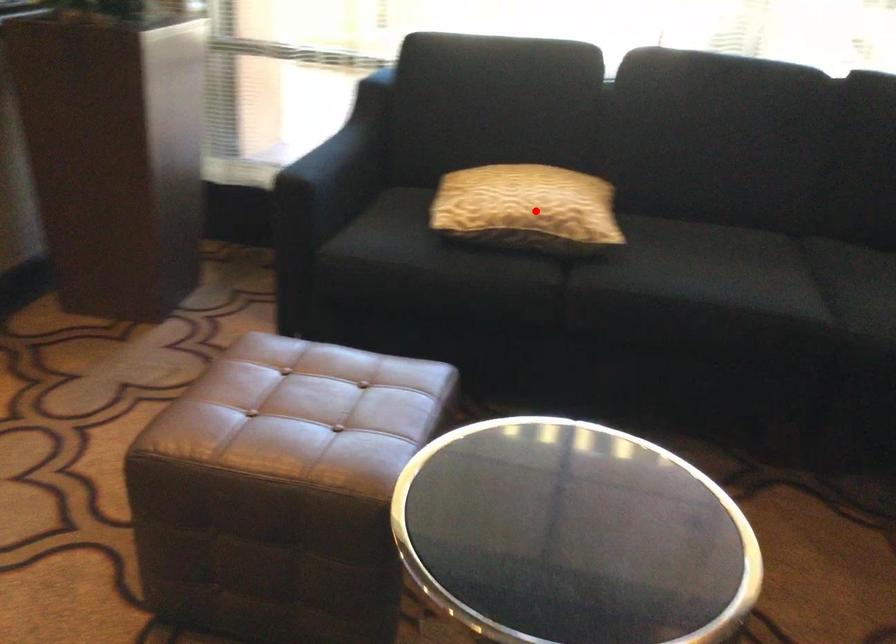
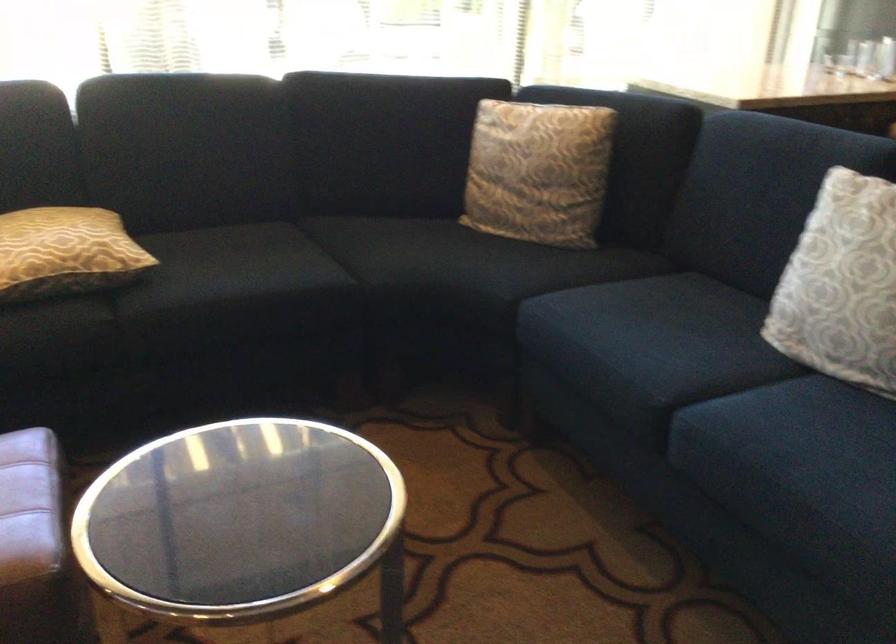
The point at the highlighted location is marked in the first image. Where is the corresponding point in the second image?

(65, 252)